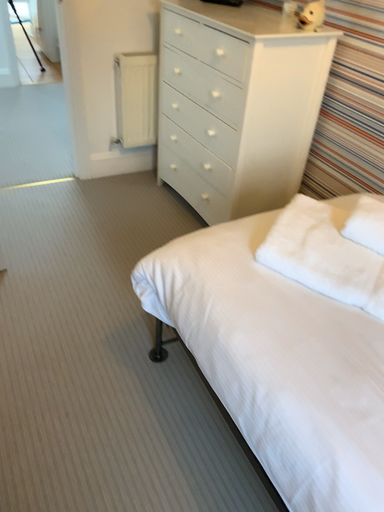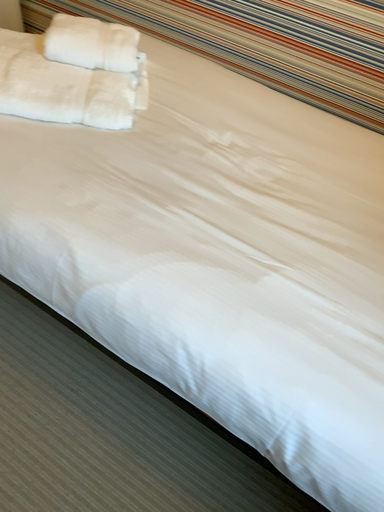
Question: How did the camera likely rotate when shooting the video?

Choices:
 (A) rotated upward
 (B) rotated downward

Answer: (B)